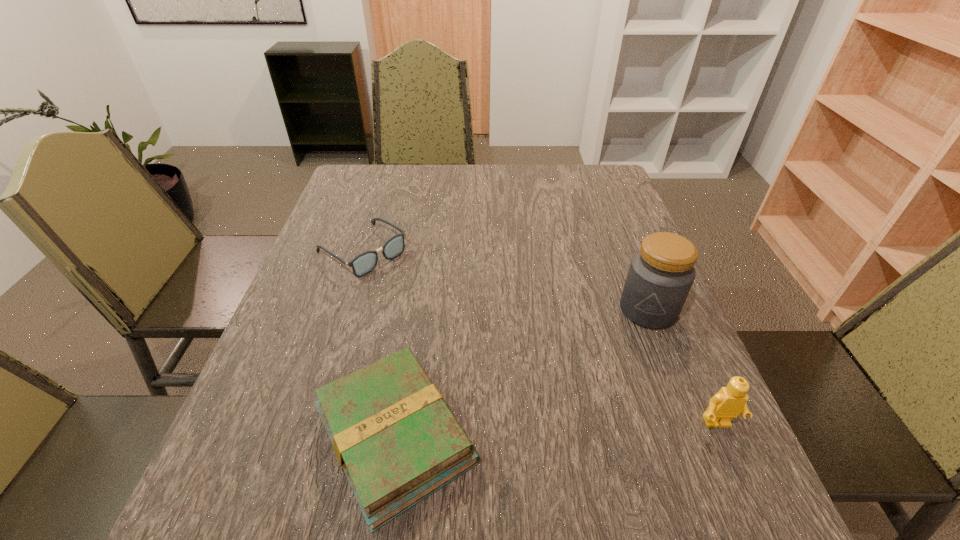
Locate an element on the screen. The width and height of the screenshot is (960, 540). book is located at coordinates (396, 440).

The width and height of the screenshot is (960, 540). Identify the location of the second tallest object. (729, 402).

I want to click on spectacles, so click(x=364, y=263).

Where is `the tallest object`? Image resolution: width=960 pixels, height=540 pixels. the tallest object is located at coordinates (661, 274).

Where is `jar`? jar is located at coordinates (661, 274).

You are a GUI agent. You are given a task and a screenshot of the screen. Output one action in this format:
    pyautogui.click(x=<x>, y=<y>)
    Task: Click on the blank space located on the back of the book
    The image size is (960, 540).
    Given the screenshot: What is the action you would take?
    pyautogui.click(x=411, y=334)

This screenshot has width=960, height=540. I want to click on vacant space situated on the face of the spectacles, so click(479, 341).

Identify the location of free space located on the face of the spectacles. The image size is (960, 540). (499, 357).

Where is `free space located 0.360m on the face of the spectacles`? The image size is (960, 540). free space located 0.360m on the face of the spectacles is located at coordinates (492, 352).

You are a GUI agent. You are given a task and a screenshot of the screen. Output one action in this format:
    pyautogui.click(x=<x>, y=<y>)
    Task: Click on the free point located 0.050m on the surface of the jar near the warning symbol
    This screenshot has height=540, width=960.
    Given the screenshot: What is the action you would take?
    pyautogui.click(x=634, y=343)